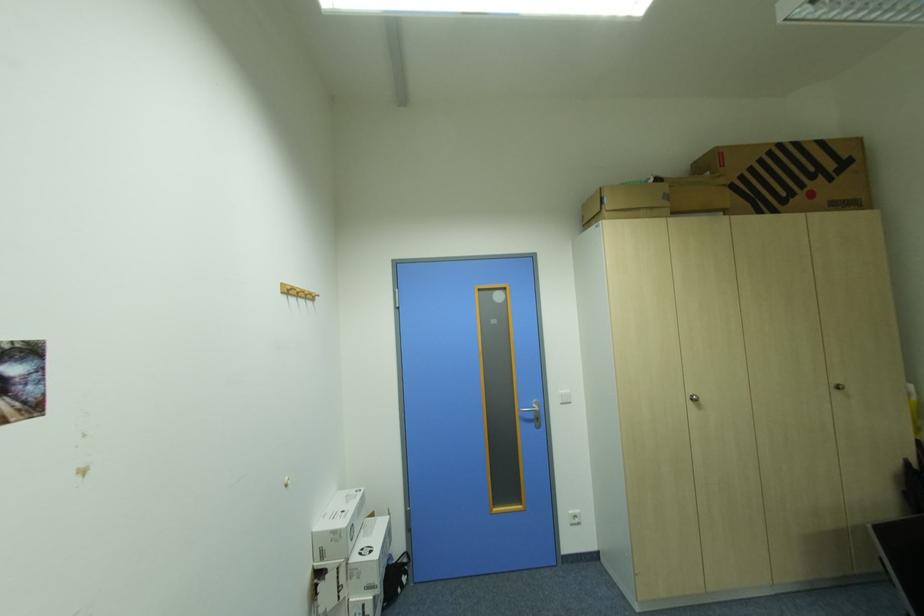
The location [795,176] corresponds to which object?

It corresponds to the large cardboard box in the image.